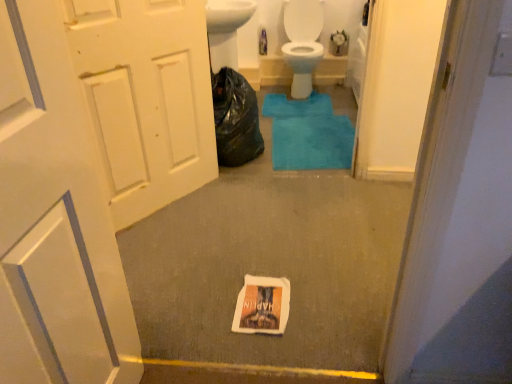
The image size is (512, 384). I want to click on unoccupied region to the right of white paper flyer at center, so [x=318, y=301].